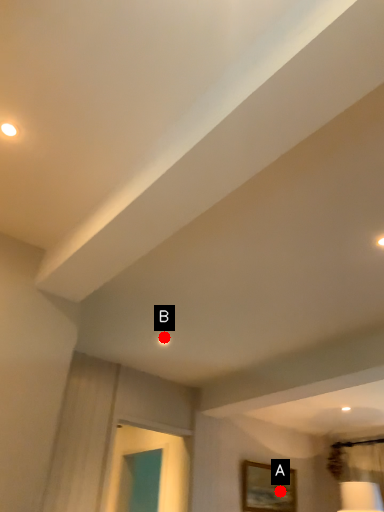
Question: Two points are circled on the image, labeled by A and B beside each circle. Which point is closer to the camera?

Choices:
 (A) A is closer
 (B) B is closer

Answer: (B)